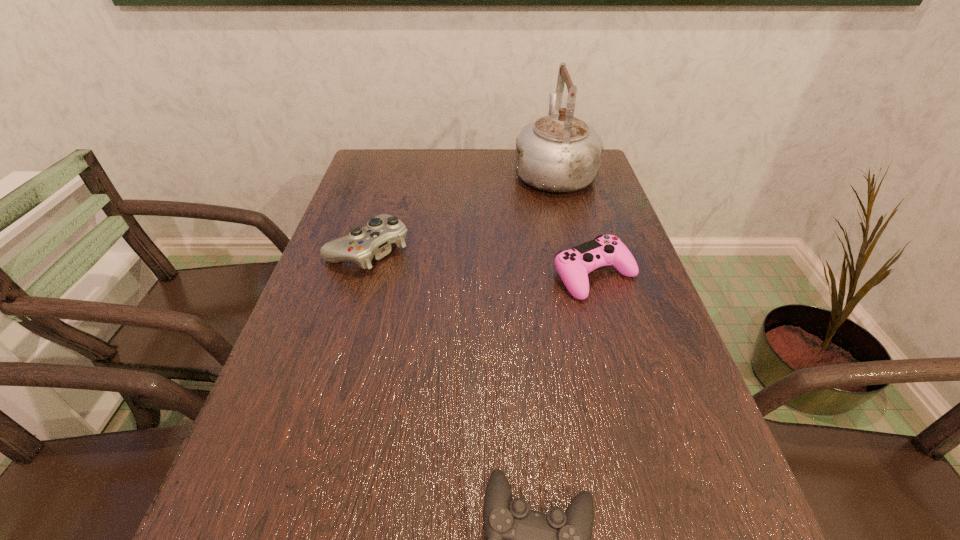
Identify which control is the second closest to the rightmost control. Please provide its 2D coordinates. Your answer should be formatted as a tuple, i.e. [(x, y)], where the tuple contains the x and y coordinates of a point satisfying the conditions above.

[(518, 539)]

Where is `control that is the second nearest to the leftmost object`? This screenshot has width=960, height=540. control that is the second nearest to the leftmost object is located at coordinates (518, 539).

Locate an element on the screen. The height and width of the screenshot is (540, 960). vacant region that satisfies the following two spatial constraints: 1. on the front side of the leftmost control; 2. on the left side of the rightmost control is located at coordinates (360, 276).